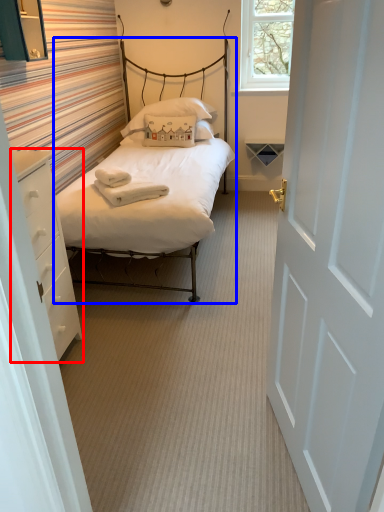
Question: Which object appears closest to the camera in this image, nightstand (highlighted by a red box) or bed (highlighted by a blue box)?

Choices:
 (A) nightstand
 (B) bed

Answer: (A)